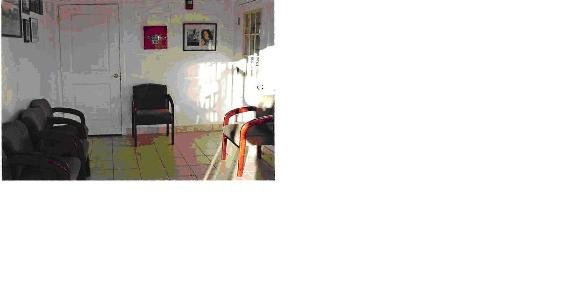
You are a GUI agent. You are given a task and a screenshot of the screen. Output one action in this format:
    pyautogui.click(x=<x>, y=<y>)
    Task: Click on the door handle
    The image size is (576, 294).
    Given the screenshot: What is the action you would take?
    pyautogui.click(x=116, y=75)